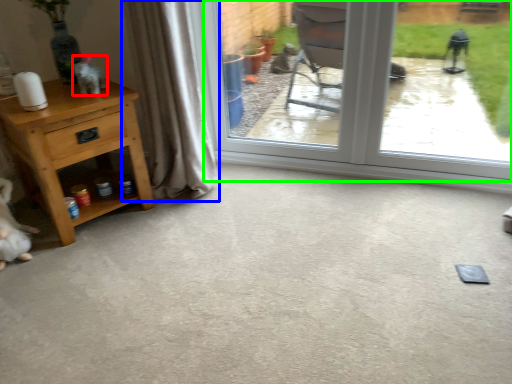
Question: Based on their relative distances, which object is nearer to animal (highlighted by a red box)? Choose from curtain (highlighted by a blue box) and window (highlighted by a green box).

Choices:
 (A) curtain
 (B) window

Answer: (A)